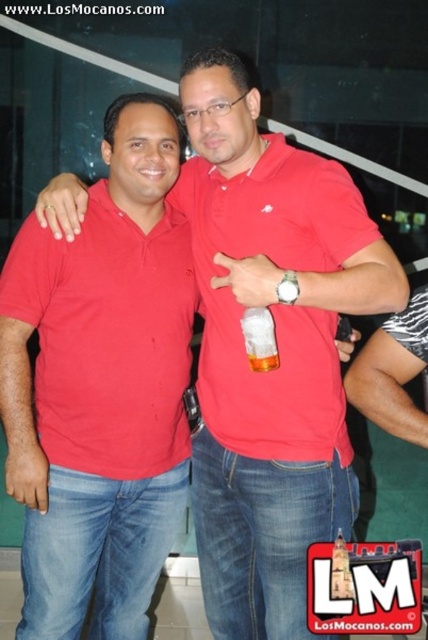
Question: Considering the real-world distances, which object is closest to the translucent plastic cup at center?

Choices:
 (A) matte red polo shirt at left
 (B) matte red polo shirt at center

Answer: (B)

Question: Does matte red polo shirt at left have a greater width compared to translucent plastic cup at center?

Choices:
 (A) no
 (B) yes

Answer: (B)

Question: Which object is farther from the camera taking this photo?

Choices:
 (A) translucent plastic cup at center
 (B) matte red polo shirt at center
 (C) matte red polo shirt at left

Answer: (C)

Question: Among these points, which one is nearest to the camera?

Choices:
 (A) (276, 243)
 (B) (193, 280)
 (C) (276, 365)

Answer: (C)

Question: Does matte red polo shirt at left have a smaller size compared to matte red polo shirt at center?

Choices:
 (A) no
 (B) yes

Answer: (B)

Question: Is the position of matte red polo shirt at left less distant than that of translucent plastic cup at center?

Choices:
 (A) yes
 (B) no

Answer: (B)